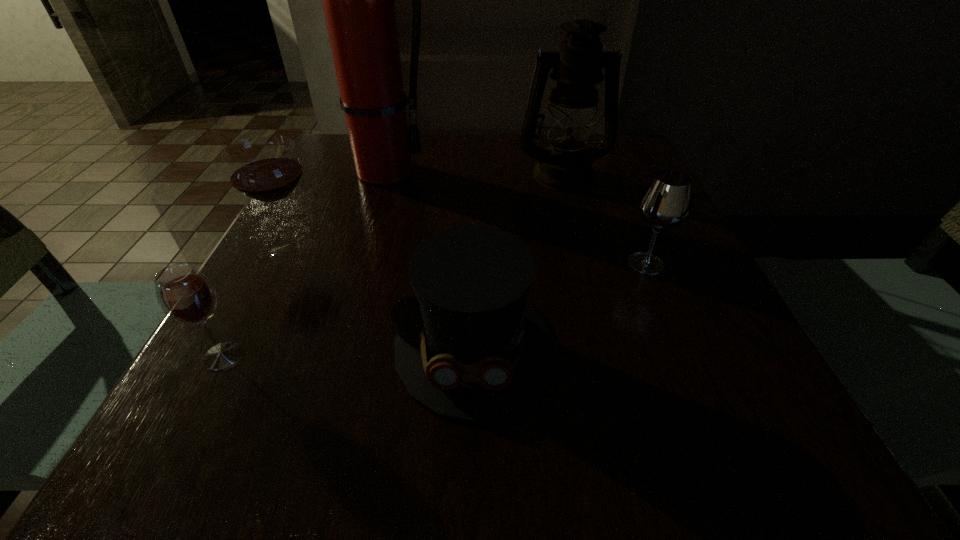
In order to click on vacant region at the left edge in this screenshot , I will do `click(346, 237)`.

Locate an element on the screen. This screenshot has height=540, width=960. vacant area at the right edge is located at coordinates (724, 333).

Identify the location of vacant space at the far left corner of the desktop. This screenshot has width=960, height=540. (343, 140).

In the image, there is a desktop. Where is `free space at the near right corner`? free space at the near right corner is located at coordinates (731, 442).

Locate an element on the screen. free space between the rightmost wineglass and the dress hat is located at coordinates (560, 303).

What are the coordinates of `free space between the rightmost wineglass and the fifth shortest object` in the screenshot? It's located at tap(605, 219).

Locate an element on the screen. The width and height of the screenshot is (960, 540). unoccupied position between the fifth shortest object and the rightmost wineglass is located at coordinates (605, 219).

Where is `empty space between the second tallest object and the fire extinguisher`? The image size is (960, 540). empty space between the second tallest object and the fire extinguisher is located at coordinates (472, 173).

Locate an element on the screen. The image size is (960, 540). free space between the dress hat and the nearest wineglass is located at coordinates [x=348, y=350].

Find the location of a particular element. This screenshot has height=540, width=960. vacant space that's between the fire extinguisher and the rightmost wineglass is located at coordinates (515, 218).